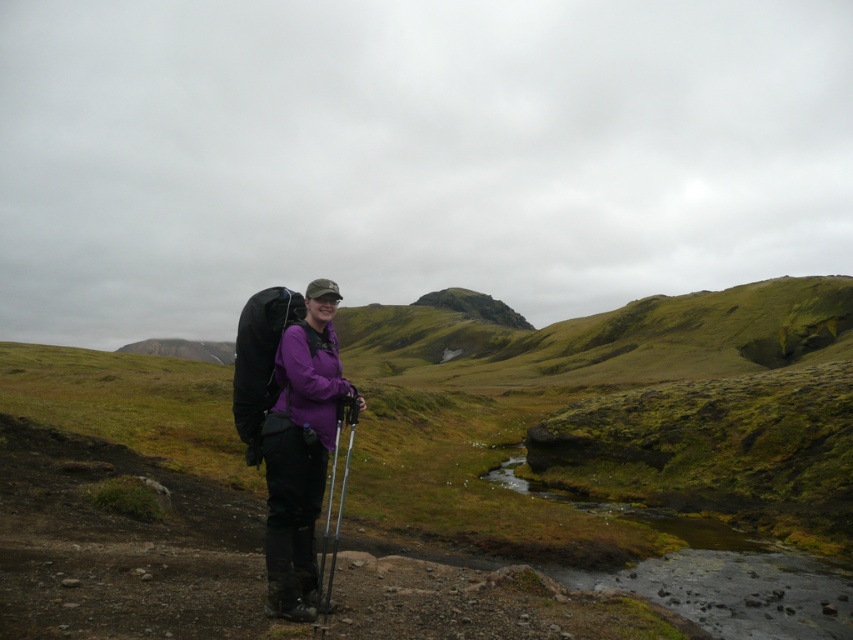
Does purple matte jacket at center appear on the left side of metallic silver ski pole at center?

Incorrect, purple matte jacket at center is not on the left side of metallic silver ski pole at center.

Who is positioned more to the right, purple matte jacket at center or metallic silver ski pole at center?

purple matte jacket at center is more to the right.

Between point (314, 564) and point (351, 413), which one is positioned in front?

Point (351, 413) is in front.

I want to click on purple matte jacket at center, so click(x=300, y=449).